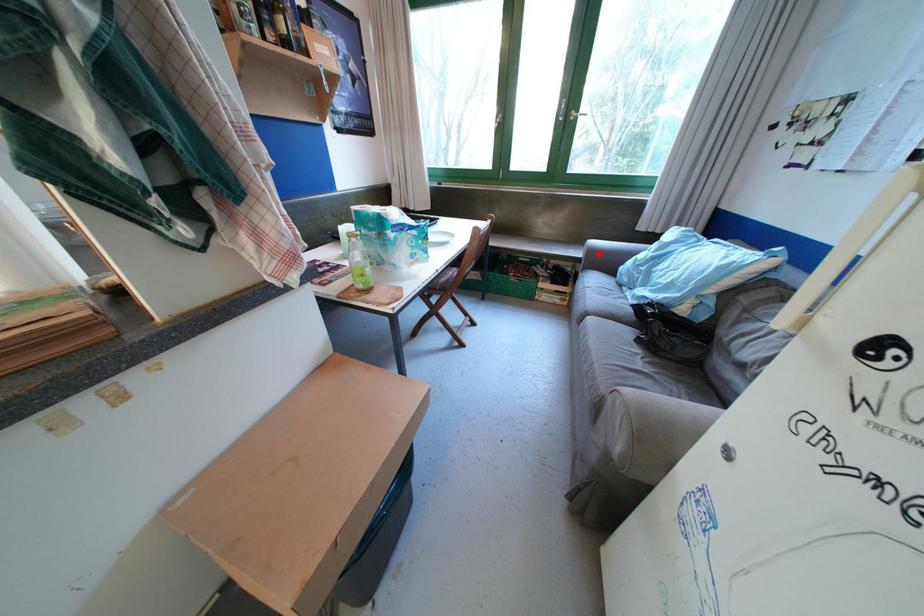
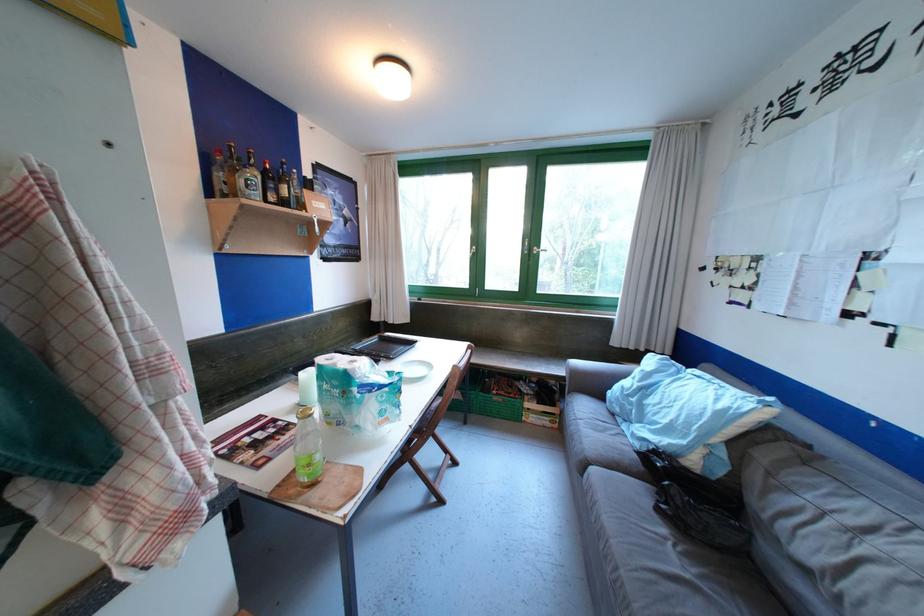
Question: I am providing you with two images of the same scene from different viewpoints. Given a red point in image1, look at the same physical point in image2. Is it:

Choices:
 (A) Closer to the viewpoint
 (B) Farther from the viewpoint

Answer: (B)